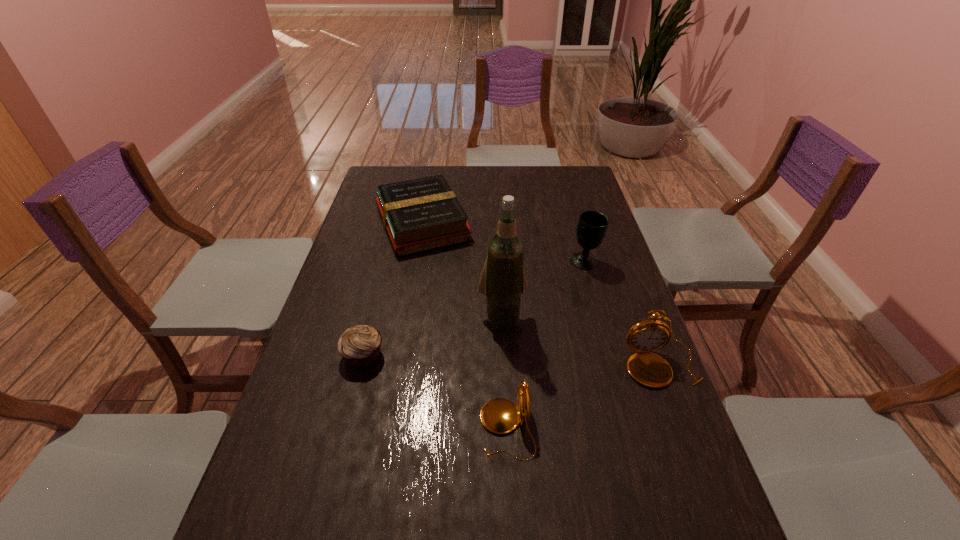
This screenshot has width=960, height=540. I want to click on free space between the chalice and the muffin, so click(x=474, y=308).

I want to click on unoccupied area between the taller pocket watch and the tallest object, so click(582, 341).

Find the location of a particular element. empty space that is in between the tallest object and the left pocket watch is located at coordinates (504, 373).

The width and height of the screenshot is (960, 540). In order to click on the fourth closest object to the farther pocket watch in this screenshot , I will do point(419,215).

This screenshot has height=540, width=960. In order to click on object that is the second closest to the left pocket watch in this screenshot , I will do (x=649, y=369).

The image size is (960, 540). Find the location of `vacant region that satisfies the following two spatial constraints: 1. on the face of the taller pocket watch; 2. on the face of the nearer pocket watch`. vacant region that satisfies the following two spatial constraints: 1. on the face of the taller pocket watch; 2. on the face of the nearer pocket watch is located at coordinates (685, 429).

Identify the location of blank space that satisfies the following two spatial constraints: 1. on the front-facing side of the third farthest object; 2. on the face of the nearest object. (508, 429).